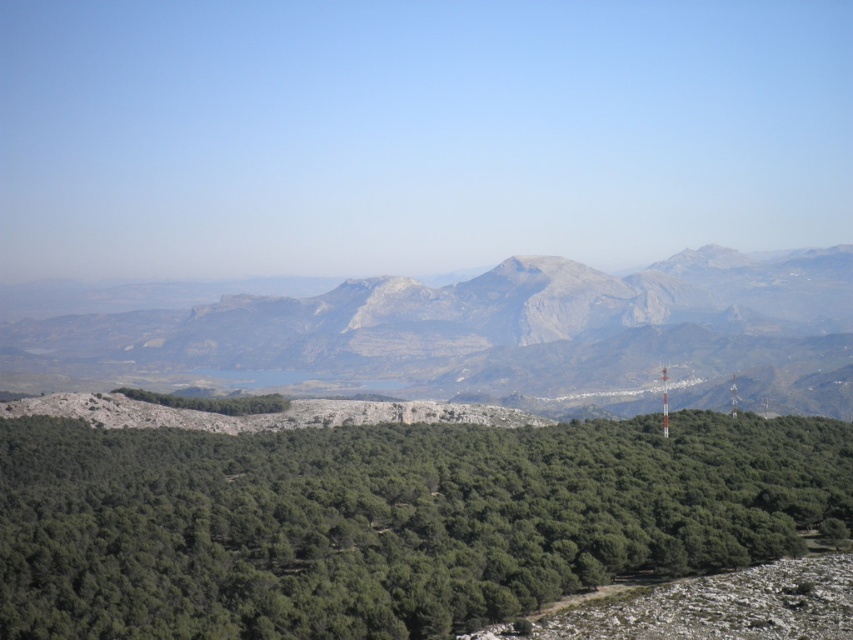
You are standing at the edge of the forest looking towards the mountains. You see the green leafy trees at center and the rugged stone mountain range at center. Which one is positioned to the left from your viewpoint?

The green leafy trees at center are positioned to the left of the rugged stone mountain range at center from your viewpoint.

Based on the scene description, where are the green leafy trees located in relation to the point marked at coordinates [387,520]?

The green leafy trees at center are located exactly at the point marked at coordinates [387,520].